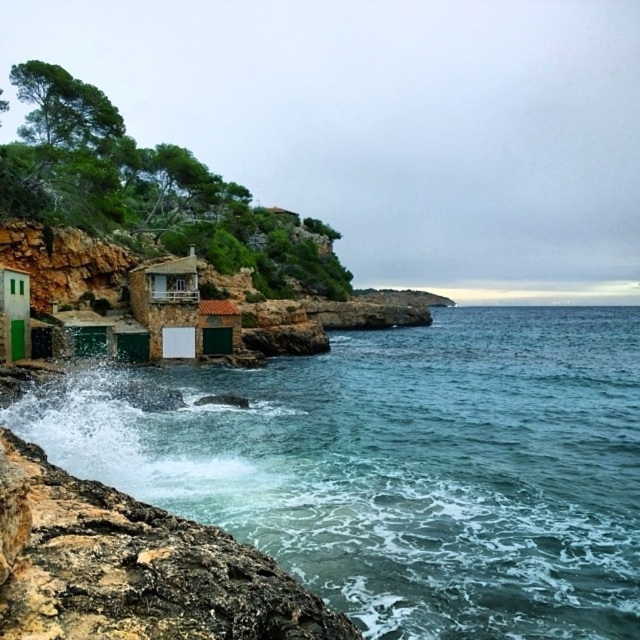
You are standing at the cliff edge looking out towards the ocean. There are two points marked on the image. Point A is at coordinates point (403,358) and Point B is at point (3,282). If you were to walk towards the ocean, which point would you encounter first?

Point B at point (3,282) would be encountered first because it is closer to the observer at the cliff edge compared to Point A, which is further away.

You are a tourist visiting the coastal village and want to find the entrance to the green matte hut at lower center. You see the green matte door at lower left. Which direction should you walk to reach the entrance?

The green matte door at lower left is positioned on the left side of green matte hut at lower center, so you should walk towards the right to reach the entrance of the green matte hut at lower center.